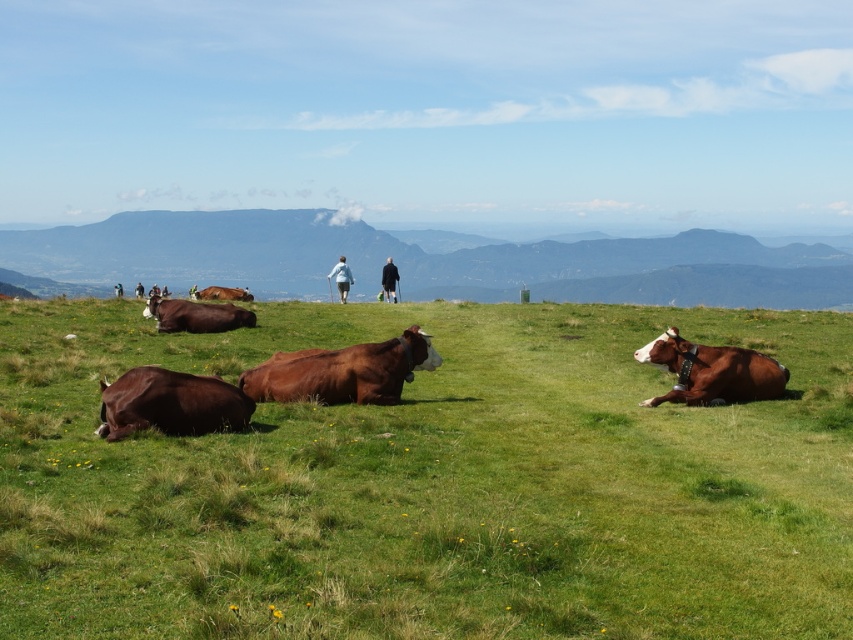
Which is more to the right, green grass at center or dark brown leather jacket at center?

green grass at center is more to the right.

What do you see at coordinates (428, 483) in the screenshot? I see `green grass at center` at bounding box center [428, 483].

Who is more forward, (x=146, y=595) or (x=393, y=296)?

Point (x=146, y=595)

Find the location of a particular element. This screenshot has width=853, height=640. green grass at center is located at coordinates 428,483.

Can you confirm if brown smooth cow at lower left is positioned below brown matte cow at center?

Correct, brown smooth cow at lower left is located below brown matte cow at center.

In the scene shown: Which of these two, brown smooth cow at lower left or brown matte cow at center, stands taller?

brown matte cow at center is taller.

Describe the element at coordinates (170, 403) in the screenshot. Image resolution: width=853 pixels, height=640 pixels. I see `brown smooth cow at lower left` at that location.

Find the location of `brown smooth cow at lower left`. brown smooth cow at lower left is located at coordinates (170, 403).

Does shiny brown cow at center lie behind dark brown leather jacket at center?

That is False.

Between point (173, 330) and point (389, 289), which one is positioned in front?

Positioned in front is point (173, 330).

Is point (173, 321) more distant than point (386, 284)?

No.

At what (x,y) coordinates should I click in order to perform the action: click on shiny brown cow at center. Please return your answer as a coordinate pair (x, y). Looking at the image, I should click on (196, 316).